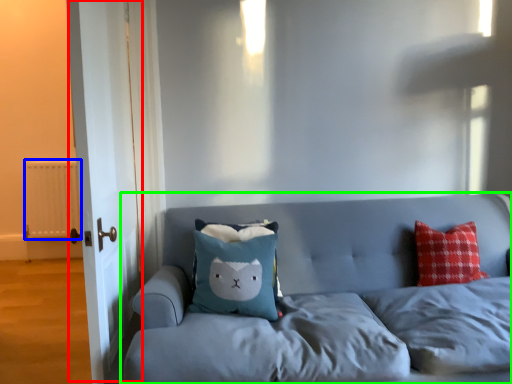
Question: Which object is the closest to the door (highlighted by a red box)? Choose among these: radiator (highlighted by a blue box) or studio couch (highlighted by a green box).

Choices:
 (A) radiator
 (B) studio couch

Answer: (B)